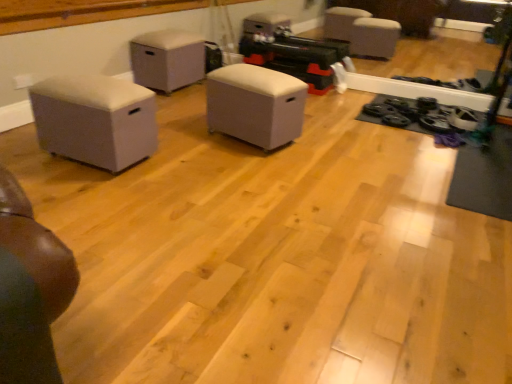
Question: From a real-world perspective, is matte gray ottoman at center, the first furniture when ordered from back to front, above or below beige fabric ottoman at left, which appears as the first furniture when viewed from the front?

Choices:
 (A) below
 (B) above

Answer: (B)

Question: In the image, is matte gray ottoman at center, which is counted as the third furniture, starting from the front, positioned in front of or behind beige fabric ottoman at left, which appears as the first furniture when viewed from the front?

Choices:
 (A) behind
 (B) front

Answer: (A)

Question: Estimate the real-world distances between objects in this image. Which object is closer to the matte gray ottoman at center, the first furniture when ordered from back to front?

Choices:
 (A) beige fabric ottoman at left, acting as the third furniture starting from the back
 (B) white fabric ottoman at center, placed as the 2th furniture when sorted from front to back

Answer: (B)

Question: Which of these objects is positioned closest to the beige fabric ottoman at left, acting as the third furniture starting from the back?

Choices:
 (A) matte gray ottoman at center, the first furniture when ordered from back to front
 (B) white fabric ottoman at center, which is the 2th furniture in back-to-front order

Answer: (B)